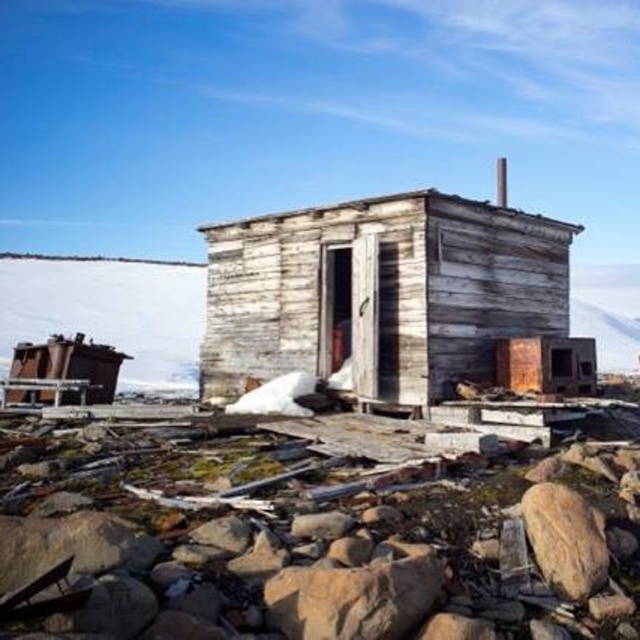
You are a hiker carrying a backpack that is 2 meters wide. You need to move from the brown rough rock at lower center to the brown rough rock at lower right. Can your backpack fit through the space between them?

The distance between the brown rough rock at lower center and brown rough rock at lower right is 1.91 meters. Since your backpack is 2 meters wide, it cannot fit through the space between them.

You are a hiker who wants to take a shortcut between the weathered wood hut at center and the brown rough rock at lower center. Which object should you walk around to get closer to the other?

Since the weathered wood hut at center is further away than the brown rough rock at lower center, you should walk around the brown rough rock at lower center to get closer to the weathered wood hut at center.

You are a hiker who needs to cross a rocky path. You see a weathered wood hut at center and a brown rough rock at lower center. Which object has a wider base to step on?

The weathered wood hut at center has a wider base than the brown rough rock at lower center, so it is better to step on the weathered wood hut at center.